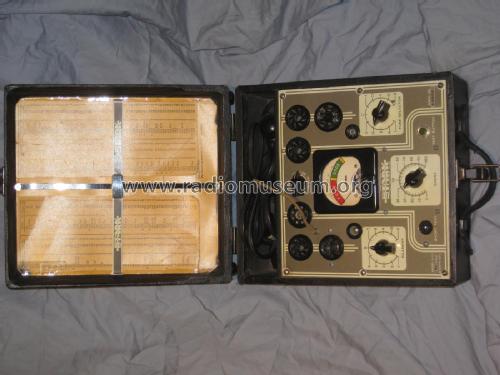
Identify the location of blanket. The image size is (500, 375). (280, 319).